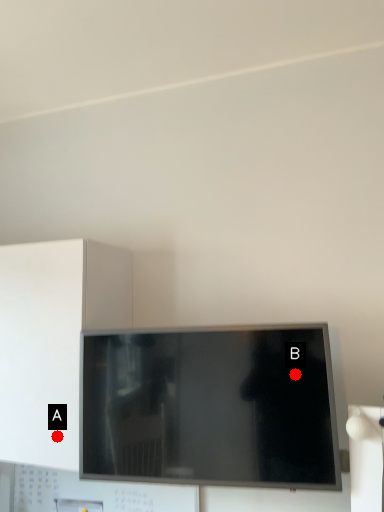
Question: Two points are circled on the image, labeled by A and B beside each circle. Which point is farther to the camera?

Choices:
 (A) A is further
 (B) B is further

Answer: (A)